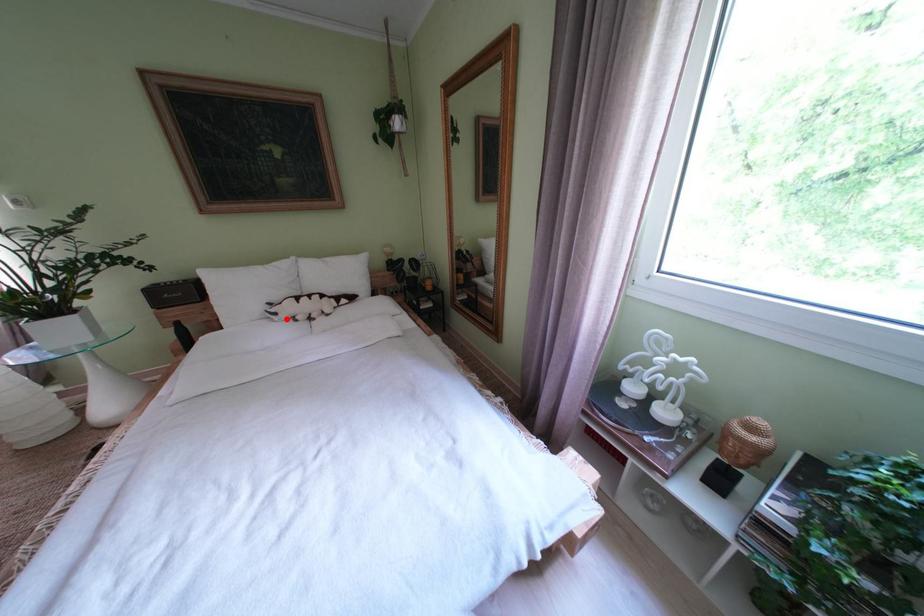
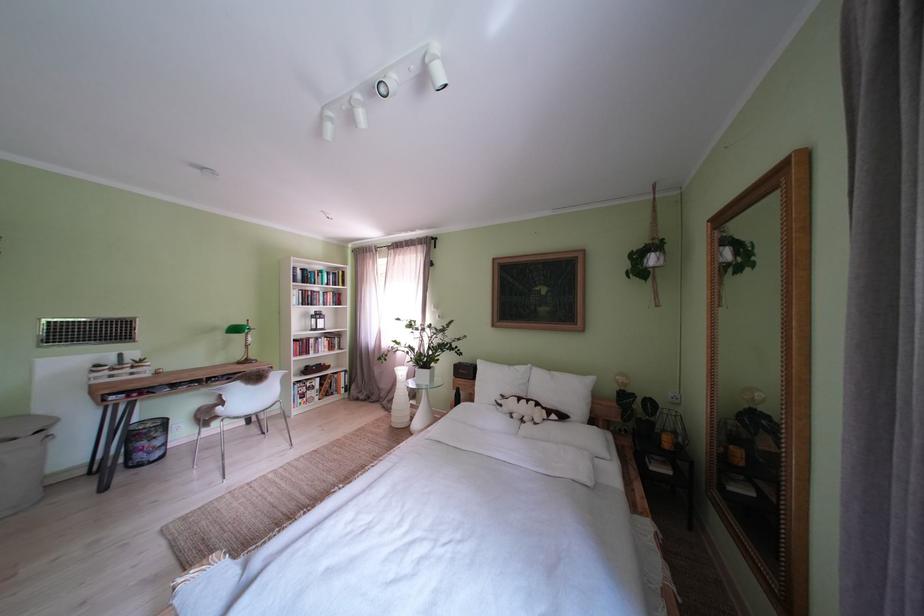
The point at the highlighted location is marked in the first image. Where is the corresponding point in the second image?

(512, 411)